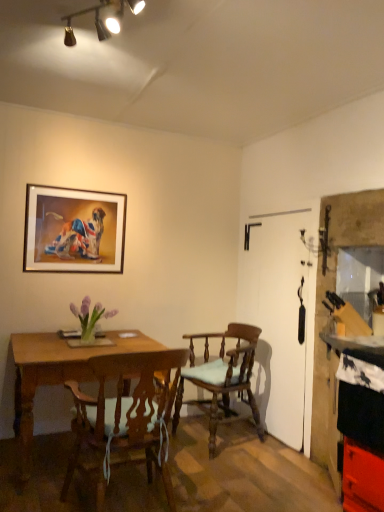
Question: From a real-world perspective, is purple glass vase at center beneath wooden chair with cushion at center, which ranks as the second chair in front-to-back order?

Choices:
 (A) yes
 (B) no

Answer: (B)

Question: Could you tell me if purple glass vase at center is facing wooden chair with cushion at center, which appears as the 1th chair when viewed from the back?

Choices:
 (A) no
 (B) yes

Answer: (A)

Question: Are purple glass vase at center and wooden chair with cushion at center, which ranks as the second chair in front-to-back order, making contact?

Choices:
 (A) yes
 (B) no

Answer: (B)

Question: Can you confirm if purple glass vase at center is shorter than wooden chair with cushion at center, which ranks as the second chair in front-to-back order?

Choices:
 (A) yes
 (B) no

Answer: (A)

Question: From the image's perspective, is purple glass vase at center on top of wooden chair with cushion at center, which ranks as the second chair in front-to-back order?

Choices:
 (A) no
 (B) yes

Answer: (B)

Question: From the image's perspective, is smooth black countertop at right positioned above or below wooden chair with cushion at center, which appears as the 1th chair when viewed from the back?

Choices:
 (A) above
 (B) below

Answer: (B)

Question: Does point (377, 485) appear closer or farther from the camera than point (243, 355)?

Choices:
 (A) closer
 (B) farther

Answer: (A)

Question: Considering their positions, is smooth black countertop at right located in front of or behind wooden chair with cushion at center, which appears as the 1th chair when viewed from the back?

Choices:
 (A) front
 (B) behind

Answer: (A)

Question: Is smooth black countertop at right inside or outside of wooden chair with cushion at center, which appears as the 1th chair when viewed from the back?

Choices:
 (A) outside
 (B) inside

Answer: (A)

Question: Based on their positions, is smooth black countertop at right located to the left or right of wooden framed picture at upper left?

Choices:
 (A) right
 (B) left

Answer: (A)

Question: Is smooth black countertop at right taller or shorter than wooden framed picture at upper left?

Choices:
 (A) short
 (B) tall

Answer: (B)

Question: Considering their positions, is smooth black countertop at right located in front of or behind wooden framed picture at upper left?

Choices:
 (A) behind
 (B) front

Answer: (B)

Question: Looking at their shapes, would you say smooth black countertop at right is wider or thinner than wooden framed picture at upper left?

Choices:
 (A) thin
 (B) wide

Answer: (B)

Question: Do you think wooden framed picture at upper left is within purple glass vase at center, or outside of it?

Choices:
 (A) outside
 (B) inside

Answer: (A)

Question: From their relative heights in the image, would you say wooden framed picture at upper left is taller or shorter than purple glass vase at center?

Choices:
 (A) short
 (B) tall

Answer: (B)